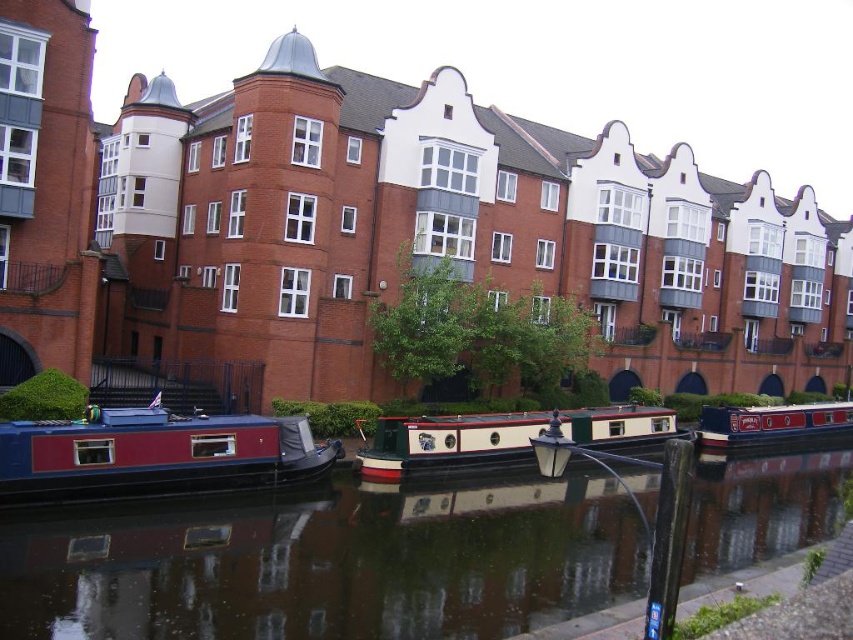
Question: Considering the real-world distances, which object is closest to the smooth dark water at center?

Choices:
 (A) blue polished wood boat at center
 (B) white glossy barge at center
 (C) matte blue boat at lower left

Answer: (B)

Question: Estimate the real-world distances between objects in this image. Which object is farther from the matte blue boat at lower left?

Choices:
 (A) smooth dark water at center
 (B) blue polished wood boat at center
 (C) white glossy barge at center

Answer: (B)

Question: Which object is farther from the camera taking this photo?

Choices:
 (A) smooth dark water at center
 (B) white glossy barge at center
 (C) blue polished wood boat at center
 (D) matte blue boat at lower left

Answer: (C)

Question: Does smooth dark water at center have a lesser width compared to blue polished wood boat at center?

Choices:
 (A) no
 (B) yes

Answer: (A)

Question: Can you confirm if smooth dark water at center is positioned to the right of blue polished wood boat at center?

Choices:
 (A) yes
 (B) no

Answer: (B)

Question: Is white glossy barge at center positioned before blue polished wood boat at center?

Choices:
 (A) yes
 (B) no

Answer: (A)